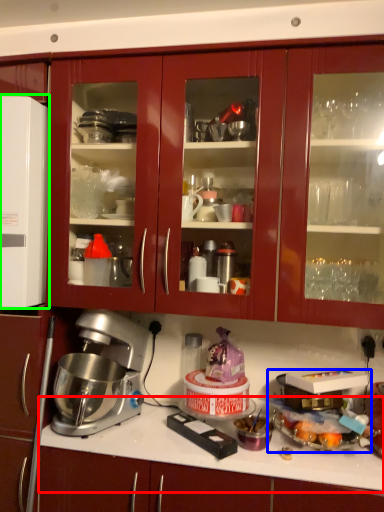
Question: Which is farther away from countertop (highlighted by a red box)? appliance (highlighted by a blue box) or appliance (highlighted by a green box)?

Choices:
 (A) appliance
 (B) appliance

Answer: (B)